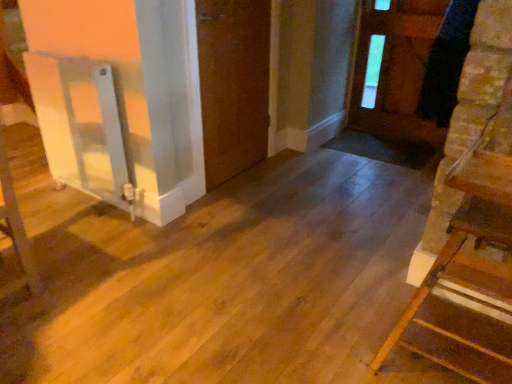
The image size is (512, 384). Identify the location of free space to the back side of wooden staircase at right. (372, 270).